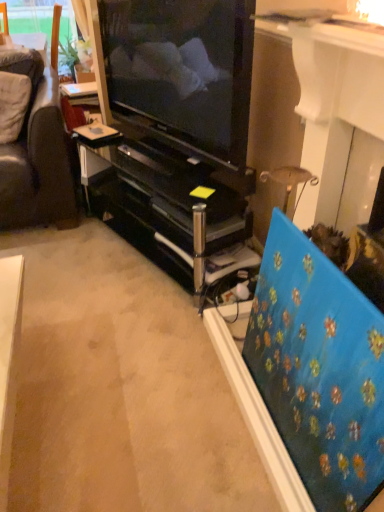
The width and height of the screenshot is (384, 512). In order to click on free space that is to the left of black glossy tv cabinet at center in this screenshot , I will do `click(69, 253)`.